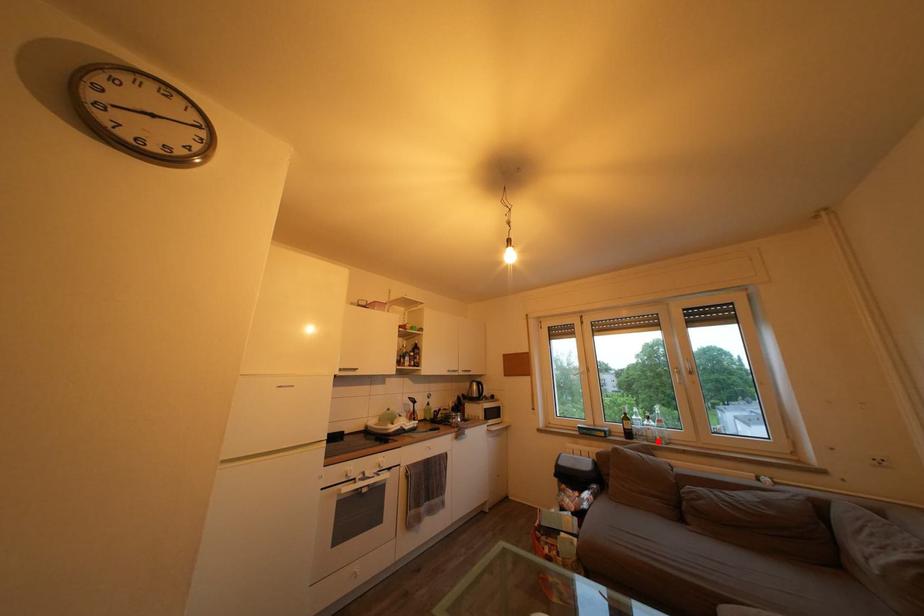
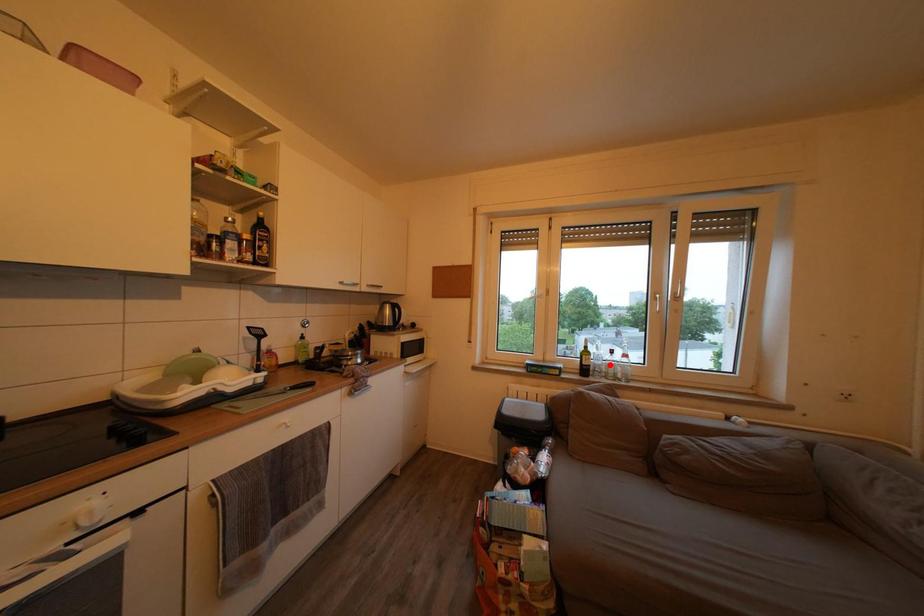
I am providing you with two images of the same scene from different viewpoints. A red point is marked on the first image and another point is marked on the second image. Does the point marked in image1 correspond to the same location as the one in image2?

No